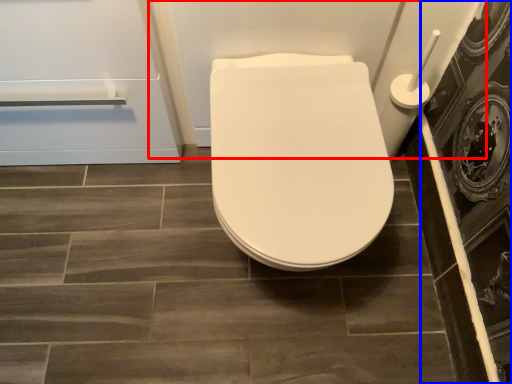
Question: Which object appears farthest to the camera in this image, bath (highlighted by a red box) or screen door (highlighted by a blue box)?

Choices:
 (A) bath
 (B) screen door

Answer: (B)